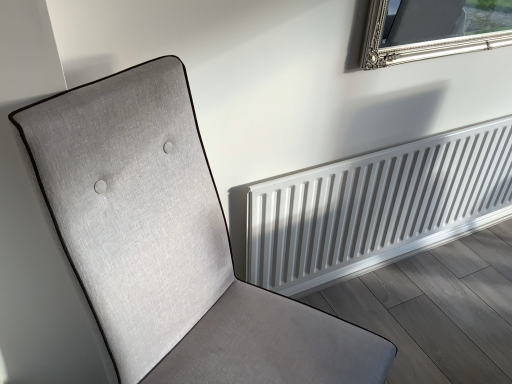
Question: Based on their positions, is textured fabric chair at left located to the left or right of white metallic radiator at lower right?

Choices:
 (A) right
 (B) left

Answer: (B)

Question: Is textured fabric chair at left inside the boundaries of white metallic radiator at lower right, or outside?

Choices:
 (A) inside
 (B) outside

Answer: (B)

Question: Considering their positions, is textured fabric chair at left located in front of or behind white metallic radiator at lower right?

Choices:
 (A) front
 (B) behind

Answer: (A)

Question: From the image's perspective, is white metallic radiator at lower right above or below textured fabric chair at left?

Choices:
 (A) below
 (B) above

Answer: (B)

Question: Considering the positions of point (510, 147) and point (313, 354), is point (510, 147) closer or farther from the camera than point (313, 354)?

Choices:
 (A) closer
 (B) farther

Answer: (B)

Question: Considering their positions, is white metallic radiator at lower right located in front of or behind textured fabric chair at left?

Choices:
 (A) front
 (B) behind

Answer: (B)

Question: Would you say white metallic radiator at lower right is to the left or to the right of textured fabric chair at left in the picture?

Choices:
 (A) left
 (B) right

Answer: (B)